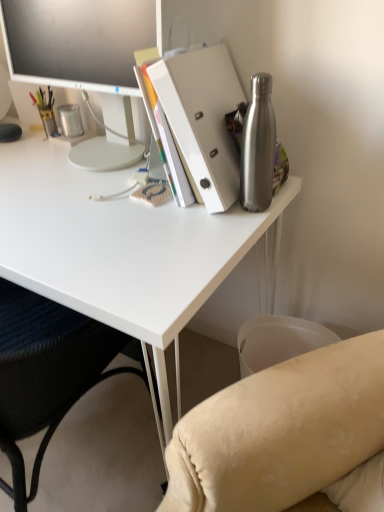
Question: Relative to metallic silver pen holder at left, is white matte desk at upper center in front or behind?

Choices:
 (A) front
 (B) behind

Answer: (A)

Question: Is white matte desk at upper center to the left or to the right of metallic silver pen holder at left in the image?

Choices:
 (A) left
 (B) right

Answer: (A)

Question: Which object is the closest to the white matte desk at upper center?

Choices:
 (A) beige fabric chair at lower left
 (B) metallic silver pen holder at left
 (C) white matte folder at upper right
 (D) white glossy monitor at upper left
 (E) brushed metal water bottle at right

Answer: (C)

Question: Which object is the farthest from the brushed metal water bottle at right?

Choices:
 (A) beige fabric chair at lower left
 (B) metallic silver pen holder at left
 (C) white matte desk at upper center
 (D) white glossy monitor at upper left
 (E) white matte folder at upper right

Answer: (B)